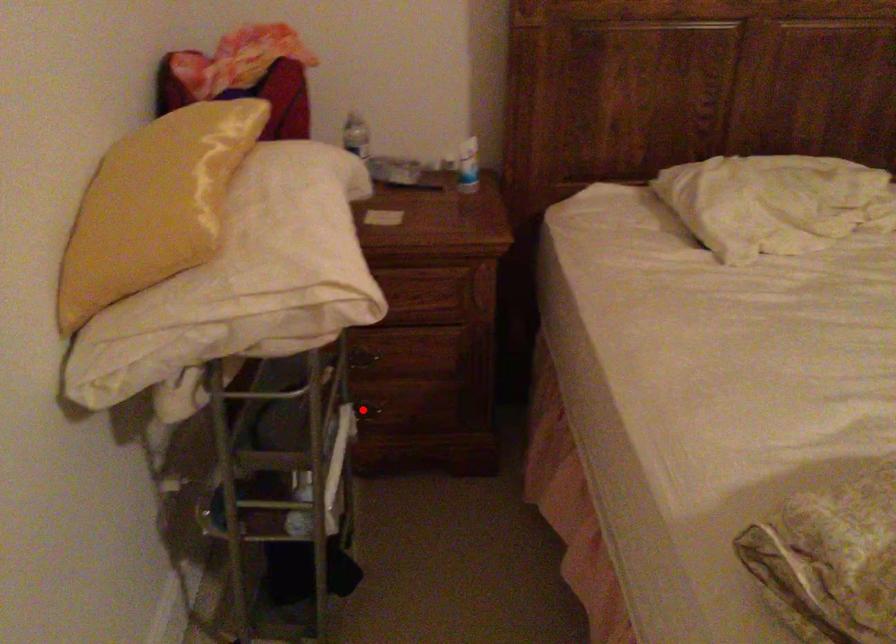
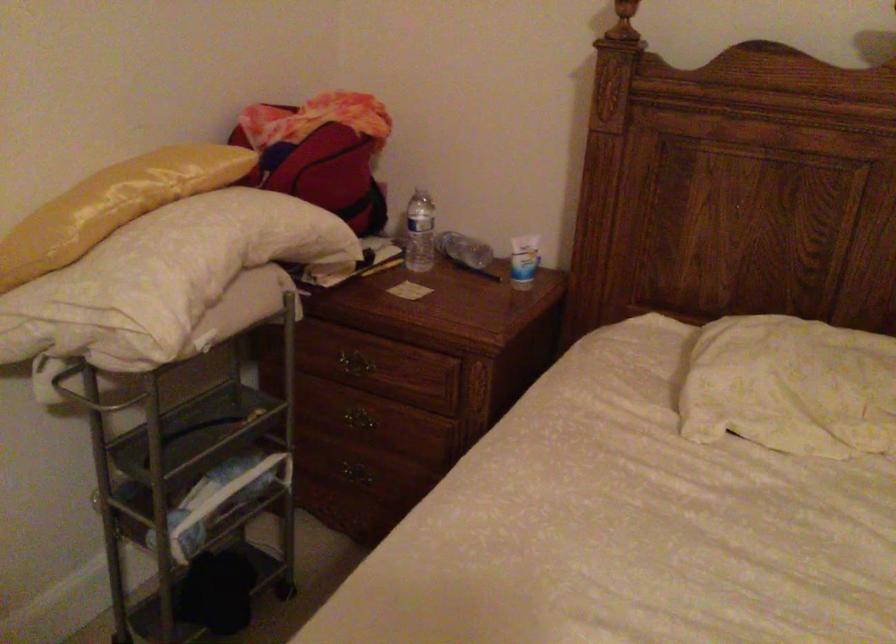
The point at the highlighted location is marked in the first image. Where is the corresponding point in the second image?

(355, 473)